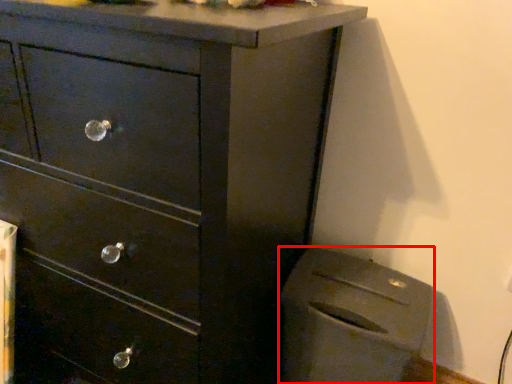
Question: From the image's perspective, considering the relative positions of appliance (annotated by the red box) and chest of drawers in the image provided, where is appliance (annotated by the red box) located with respect to the staircase?

Choices:
 (A) above
 (B) below

Answer: (B)